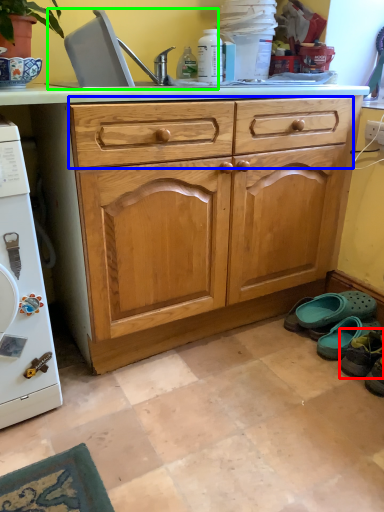
Question: Which object is positioned farthest from footwear (highlighted by a red box)? Select from drawer (highlighted by a blue box) and sink (highlighted by a green box).

Choices:
 (A) drawer
 (B) sink

Answer: (B)